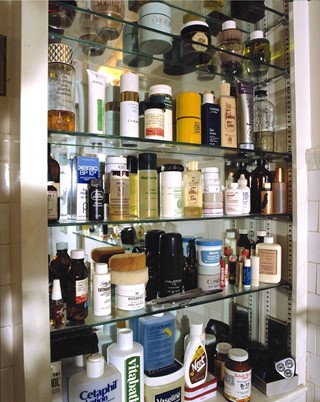
I want to click on sponges, so click(125, 261), click(131, 276).